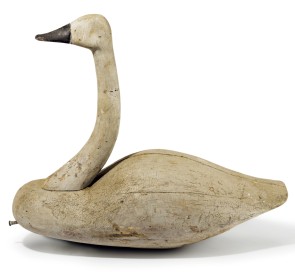
Locate an element on the screen. Image resolution: width=295 pixels, height=272 pixels. silver metallic screw is located at coordinates (10, 222).